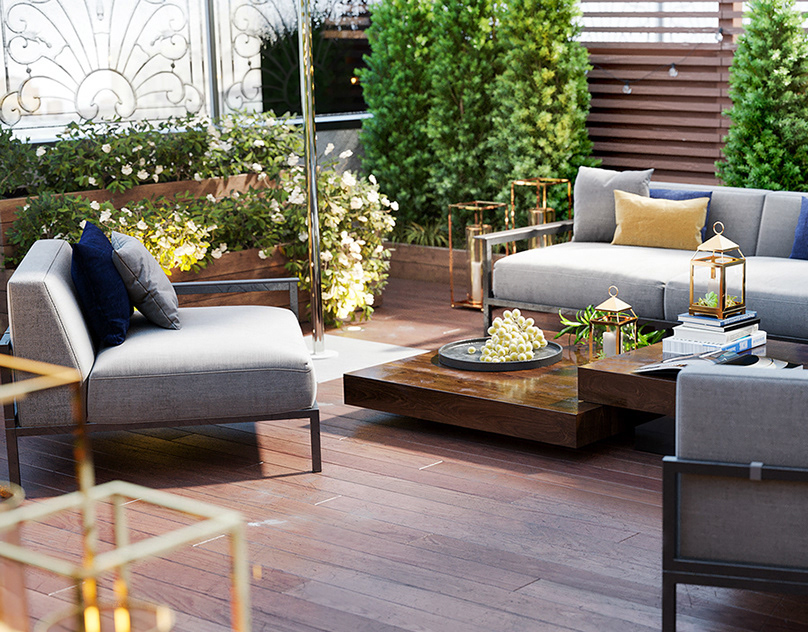
Where is `books`? The width and height of the screenshot is (808, 632). books is located at coordinates (772, 365), (760, 343), (747, 343), (713, 329), (693, 332).